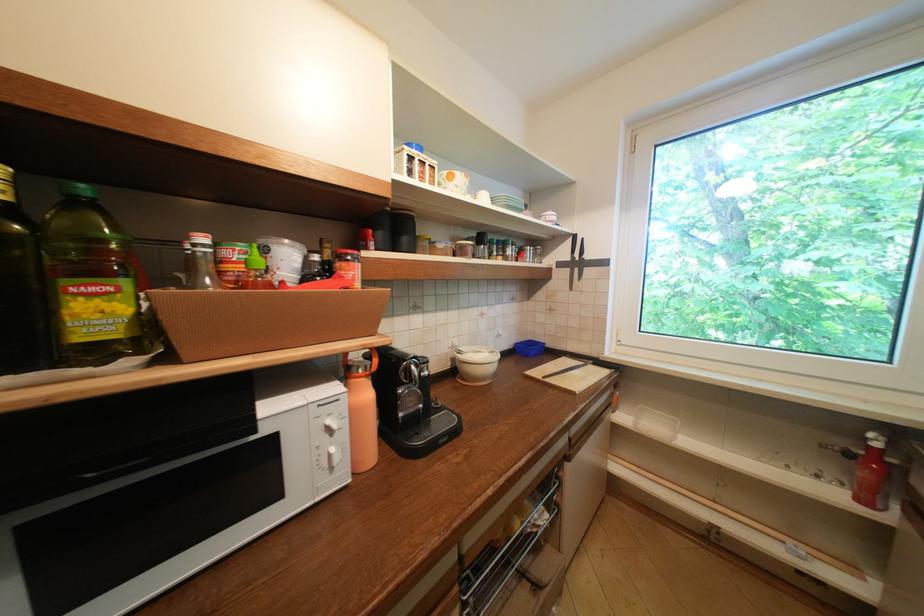
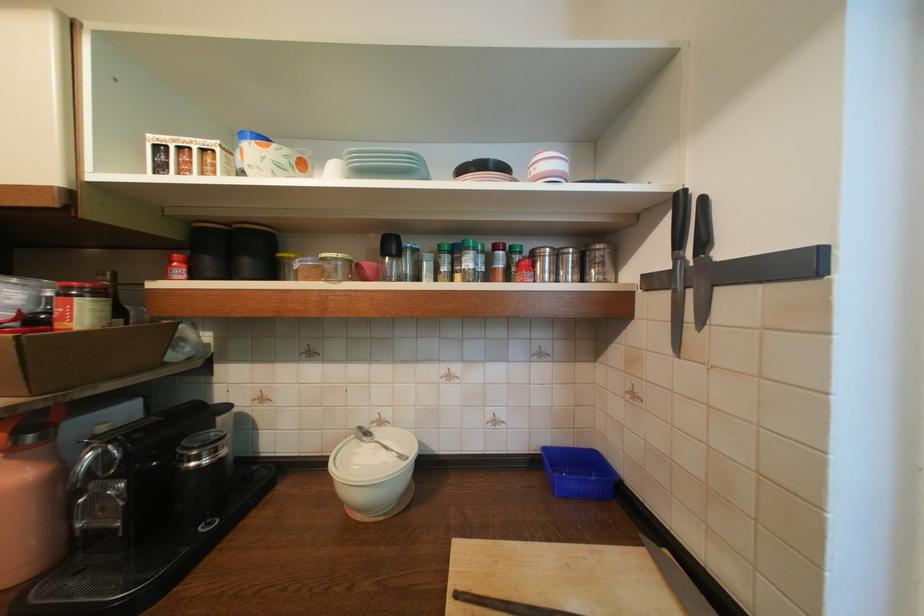
In the second image, find the point that corresponds to point (521, 347) in the first image.

(550, 454)